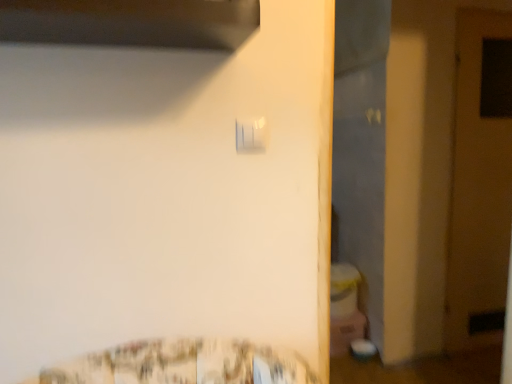
What do you see at coordinates (251, 135) in the screenshot?
I see `white plastic light switch at upper center` at bounding box center [251, 135].

Find the location of a particular element. The width and height of the screenshot is (512, 384). white plastic light switch at upper center is located at coordinates (251, 135).

Describe the element at coordinates (480, 182) in the screenshot. I see `wooden door at right` at that location.

Image resolution: width=512 pixels, height=384 pixels. Identify the location of wooden door at right. (480, 182).

At what (x,y) coordinates should I click in order to perform the action: click on white plastic light switch at upper center. Please return your answer as a coordinate pair (x, y). The height and width of the screenshot is (384, 512). Looking at the image, I should click on (251, 135).

Can you confirm if wooden door at right is positioned to the left of white plastic light switch at upper center?

In fact, wooden door at right is to the right of white plastic light switch at upper center.

Is the depth of wooden door at right greater than that of white plastic light switch at upper center?

Yes, it is.

Does point (502, 325) appear closer or farther from the camera than point (248, 136)?

Point (502, 325) appears to be farther away from the viewer than point (248, 136).

From the image's perspective, would you say wooden door at right is positioned over white plastic light switch at upper center?

No, from the image's perspective, wooden door at right is not on top of white plastic light switch at upper center.

From a real-world perspective, which is physically below, wooden door at right or white plastic light switch at upper center?

wooden door at right.

Which of these two, wooden door at right or white plastic light switch at upper center, is thinner?

white plastic light switch at upper center is thinner.

From their relative heights in the image, would you say wooden door at right is taller or shorter than white plastic light switch at upper center?

wooden door at right is taller than white plastic light switch at upper center.

Which of these two, wooden door at right or white plastic light switch at upper center, is smaller?

With smaller size is white plastic light switch at upper center.

Is wooden door at right located outside white plastic light switch at upper center?

Indeed, wooden door at right is completely outside white plastic light switch at upper center.

Are wooden door at right and white plastic light switch at upper center far apart?

Yes, wooden door at right and white plastic light switch at upper center are located far from each other.

Consider the image. Is wooden door at right facing away from white plastic light switch at upper center?

No, white plastic light switch at upper center is not at the back of wooden door at right.

What's the angular difference between wooden door at right and white plastic light switch at upper center's facing directions?

4.55 degrees separate the facing orientations of wooden door at right and white plastic light switch at upper center.

The height and width of the screenshot is (384, 512). In order to click on door that appears on the right of white plastic light switch at upper center in this screenshot , I will do `click(480, 182)`.

Which object is positioned more to the left, white plastic light switch at upper center or wooden door at right?

Positioned to the left is white plastic light switch at upper center.

Which object is further away from the camera taking this photo, white plastic light switch at upper center or wooden door at right?

wooden door at right is behind.

Between point (251, 140) and point (451, 315), which one is positioned behind?

The point (451, 315) is farther from the camera.

From the image's perspective, is white plastic light switch at upper center on wooden door at right?

Correct, white plastic light switch at upper center appears higher than wooden door at right in the image.

From a real-world perspective, which is physically below, white plastic light switch at upper center or wooden door at right?

wooden door at right is physically lower.

Which object is wider, white plastic light switch at upper center or wooden door at right?

wooden door at right is wider.

Considering the sizes of objects white plastic light switch at upper center and wooden door at right in the image provided, who is taller, white plastic light switch at upper center or wooden door at right?

Standing taller between the two is wooden door at right.

Who is bigger, white plastic light switch at upper center or wooden door at right?

wooden door at right is bigger.

Is white plastic light switch at upper center surrounding wooden door at right?

No, wooden door at right is not inside white plastic light switch at upper center.

Are white plastic light switch at upper center and wooden door at right far apart?

That's right, there is a large distance between white plastic light switch at upper center and wooden door at right.

Is white plastic light switch at upper center facing away from wooden door at right?

No, white plastic light switch at upper center is not facing away from wooden door at right.

How many degrees apart are the facing directions of white plastic light switch at upper center and wooden door at right?

4.55 degrees.

This screenshot has width=512, height=384. I want to click on light switch on the left of wooden door at right, so click(251, 135).

The image size is (512, 384). What are the coordinates of `light switch above the wooden door at right (from the image's perspective)` in the screenshot? It's located at (251, 135).

Find the location of a particular element. door below the white plastic light switch at upper center (from the image's perspective) is located at coordinates (480, 182).